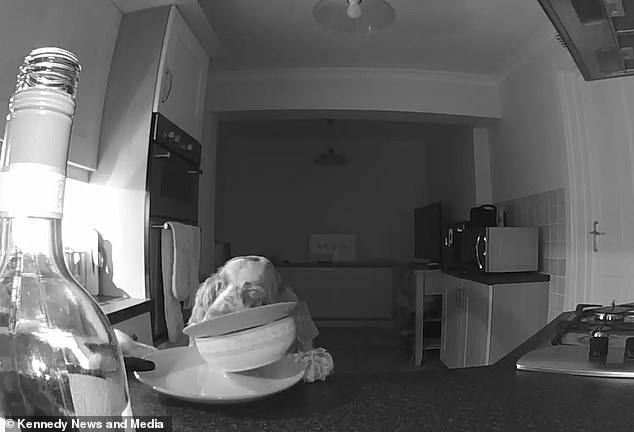
Where is `gas oven burners`? gas oven burners is located at coordinates (600, 334), (614, 309).